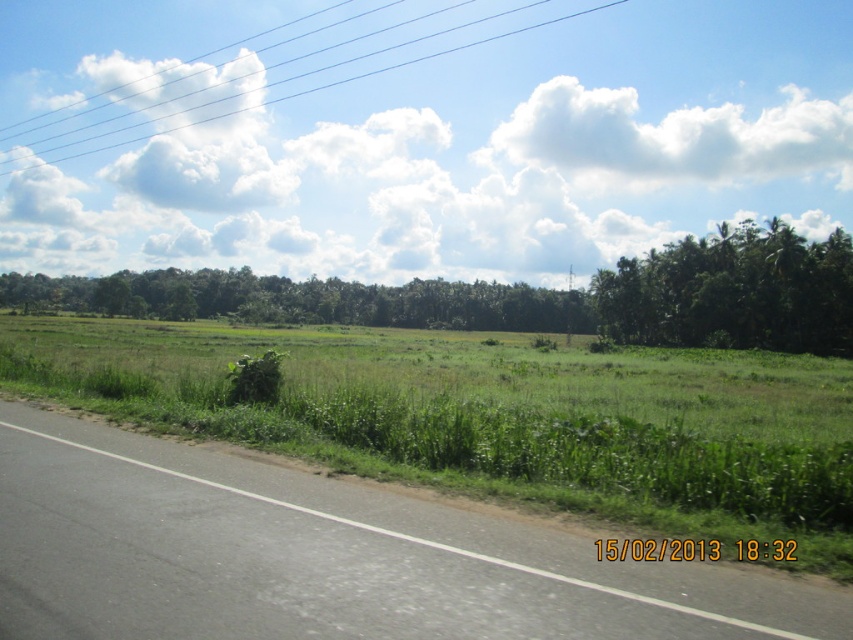
You are driving a car and see the green leafy trees at right and the white wire at upper center. Which object is closer to you?

The green leafy trees at right is closer to you because it has a smaller size compared to the white wire at upper center, which indicates it is farther away.

You are standing at the edge of the road and want to reach the point marked as point (287,634) and point (474,289). Which point should you head towards if you want to reach the one that is closer to your current position?

You should head towards point (287,634) because it is closer to the camera, which is your current position, compared to point (474,289).